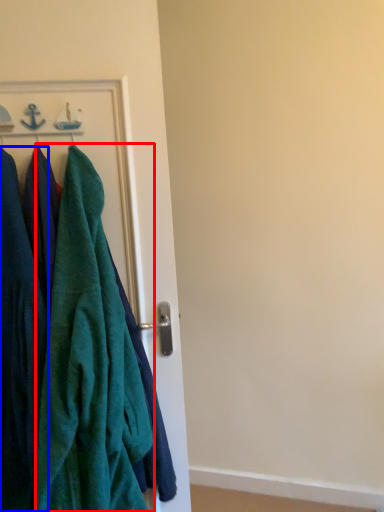
Question: Which of the following is the farthest to the observer, towel (highlighted by a red box) or cloak (highlighted by a blue box)?

Choices:
 (A) towel
 (B) cloak

Answer: (B)